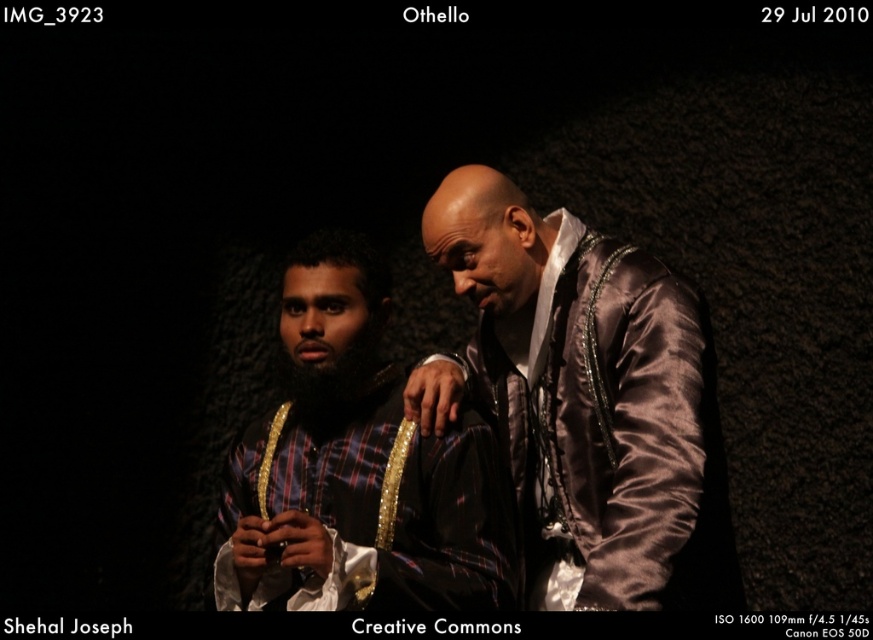
Question: Which point appears farthest from the camera in this image?

Choices:
 (A) (265, 440)
 (B) (674, 312)

Answer: (A)

Question: Can you confirm if satin brown jacket at center is positioned below plaid fabric shirt at center?

Choices:
 (A) no
 (B) yes

Answer: (A)

Question: Does satin brown jacket at center have a lesser width compared to plaid fabric shirt at center?

Choices:
 (A) yes
 (B) no

Answer: (A)

Question: Can you confirm if satin brown jacket at center is wider than plaid fabric shirt at center?

Choices:
 (A) yes
 (B) no

Answer: (B)

Question: Which object is closer to the camera taking this photo?

Choices:
 (A) satin brown jacket at center
 (B) plaid fabric shirt at center

Answer: (A)